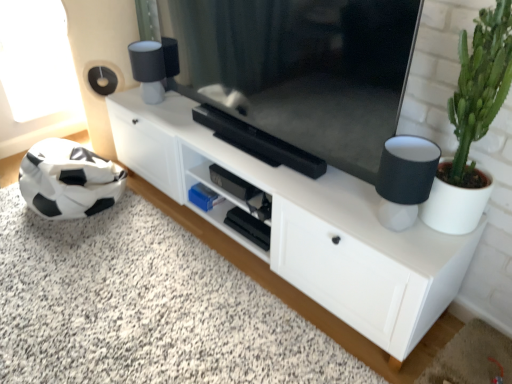
At what (x,y) coordinates should I click in order to perform the action: click on black fabric lampshade at right. Please return your answer as a coordinate pair (x, y). Looking at the image, I should click on (405, 179).

Find the location of a particular element. This screenshot has width=512, height=384. white matte cabinet at center is located at coordinates (305, 225).

What do you see at coordinates (295, 67) in the screenshot? I see `matte black television at center` at bounding box center [295, 67].

What do you see at coordinates (473, 119) in the screenshot?
I see `green succulent at right` at bounding box center [473, 119].

In order to click on black matte soccer ball at lower left in this screenshot , I will do `click(144, 307)`.

What is the approximate width of black matte soccer ball at lower left?

The width of black matte soccer ball at lower left is 96.86 centimeters.

Where is `black fabric lampshade at right`? The height and width of the screenshot is (384, 512). black fabric lampshade at right is located at coordinates (405, 179).

Can you confirm if white matte cabinet at center is taller than matte black television at center?

No, white matte cabinet at center is not taller than matte black television at center.

What are the coordinates of `cabinetry to the left of matte black television at center` in the screenshot? It's located at (305, 225).

Which point is more forward, (384,275) or (415,21)?

The point (415,21) is in front.

Can you confirm if black fabric lampshade at right is shorter than green succulent at right?

Indeed, black fabric lampshade at right has a lesser height compared to green succulent at right.

Between black fabric lampshade at right and green succulent at right, which one is positioned in front?

green succulent at right is more forward.

Which object is wider, black fabric lampshade at right or green succulent at right?

green succulent at right is wider.

Can you tell me how much green succulent at right and matte black television at center differ in facing direction?

The angle between the facing direction of green succulent at right and the facing direction of matte black television at center is 0.0653 degrees.

Is green succulent at right bigger than matte black television at center?

No.

Visually, is green succulent at right positioned to the left or to the right of matte black television at center?

In the image, green succulent at right appears on the right side of matte black television at center.

Is green succulent at right placed right next to matte black television at center?

No.

Considering the sizes of black matte soccer ball at lower left and white matte cabinet at center in the image, is black matte soccer ball at lower left bigger or smaller than white matte cabinet at center?

In the image, black matte soccer ball at lower left appears to be smaller than white matte cabinet at center.

Are black matte soccer ball at lower left and white matte cabinet at center far apart?

No, black matte soccer ball at lower left is in close proximity to white matte cabinet at center.

Do you think black matte soccer ball at lower left is within white matte cabinet at center, or outside of it?

black matte soccer ball at lower left is outside white matte cabinet at center.

Considering the positions of objects black fabric lampshade at right and white matte cabinet at center in the image provided, who is behind, black fabric lampshade at right or white matte cabinet at center?

white matte cabinet at center.

Would you say white matte cabinet at center is part of black fabric lampshade at right's contents?

No, white matte cabinet at center is not surrounded by black fabric lampshade at right.

Considering the sizes of objects black fabric lampshade at right and white matte cabinet at center in the image provided, who is bigger, black fabric lampshade at right or white matte cabinet at center?

white matte cabinet at center is bigger.

Measure the distance between black fabric lampshade at right and white matte cabinet at center.

black fabric lampshade at right and white matte cabinet at center are 16.41 inches apart from each other.

Considering the points (326, 52) and (29, 280), which point is behind, point (326, 52) or point (29, 280)?

Positioned behind is point (29, 280).

From a real-world perspective, is matte black television at center under black matte soccer ball at lower left?

No, from a real-world perspective, matte black television at center is not under black matte soccer ball at lower left.

Do you think matte black television at center is within black matte soccer ball at lower left, or outside of it?

matte black television at center is outside black matte soccer ball at lower left.

Which object is more forward, matte black television at center or black matte soccer ball at lower left?

black matte soccer ball at lower left is more forward.

Is there a large distance between green succulent at right and white matte cabinet at center?

They are positioned close to each other.

Considering the relative positions of green succulent at right and white matte cabinet at center in the image provided, is green succulent at right to the left or to the right of white matte cabinet at center?

green succulent at right is to the right of white matte cabinet at center.

Which of these two, green succulent at right or white matte cabinet at center, stands taller?

green succulent at right.

Measure the distance between green succulent at right and white matte cabinet at center.

21.17 inches.

This screenshot has height=384, width=512. In order to click on cabinetry that appears below the matte black television at center (from a real-world perspective) in this screenshot , I will do `click(305, 225)`.

Identify the location of lamp below the green succulent at right (from the image's perspective). (405, 179).

Considering their positions, is white matte cabinet at center positioned further to green succulent at right than matte black television at center?

Among the two, white matte cabinet at center is located further to green succulent at right.

Considering their positions, is matte black television at center positioned closer to green succulent at right than white matte cabinet at center?

matte black television at center is positioned closer to the anchor green succulent at right.

Considering their positions, is black matte soccer ball at lower left positioned further to green succulent at right than black fabric lampshade at right?

black matte soccer ball at lower left lies further to green succulent at right than the other object.

Considering their positions, is green succulent at right positioned closer to black matte soccer ball at lower left than matte black television at center?

Among the two, matte black television at center is located nearer to black matte soccer ball at lower left.

Estimate the real-world distances between objects in this image. Which object is further from black fabric lampshade at right, white matte cabinet at center or black matte soccer ball at lower left?

black matte soccer ball at lower left.

Based on their spatial positions, is black fabric lampshade at right or white matte cabinet at center closer to matte black television at center?

Among the two, white matte cabinet at center is located nearer to matte black television at center.

Looking at the image, which one is located further to green succulent at right, black matte soccer ball at lower left or matte black television at center?

Based on the image, black matte soccer ball at lower left appears to be further to green succulent at right.

Consider the image. Which object lies nearer to the anchor point black fabric lampshade at right, black matte soccer ball at lower left or green succulent at right?

green succulent at right is closer to black fabric lampshade at right.

Find the location of a particular element. The image size is (512, 384). cabinetry between matte black television at center and black matte soccer ball at lower left vertically is located at coordinates (305, 225).

At what (x,y) coordinates should I click in order to perform the action: click on cabinetry located between black matte soccer ball at lower left and green succulent at right in the left-right direction. Please return your answer as a coordinate pair (x, y). Looking at the image, I should click on (305, 225).

Find the location of a particular element. television between white matte cabinet at center and black fabric lampshade at right from left to right is located at coordinates (295, 67).

What are the coordinates of `cabinetry between black matte soccer ball at lower left and black fabric lampshade at right in the horizontal direction` in the screenshot? It's located at (305, 225).